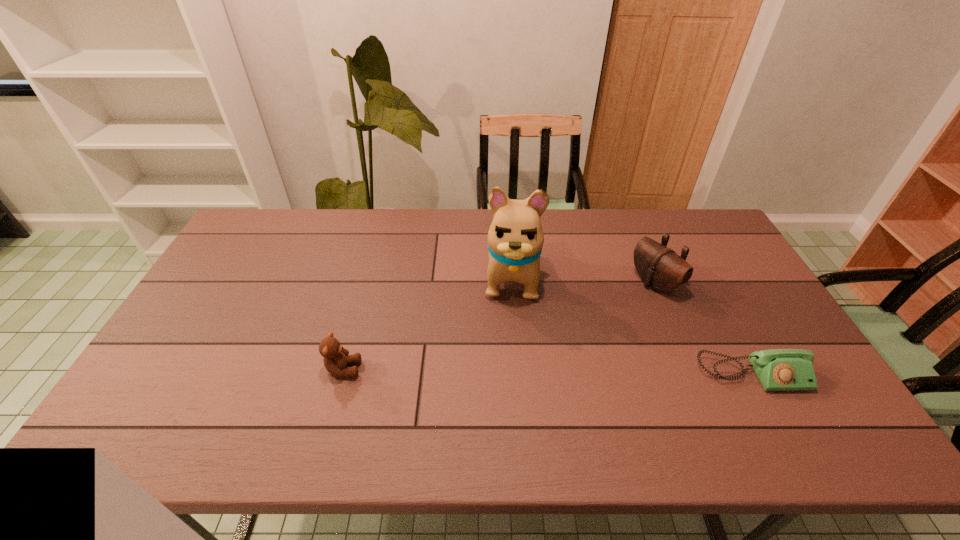
This screenshot has width=960, height=540. What are the coordinates of `vacant space on the desktop that is between the teddy bear and the telephone and is positioned on the face of the second object from left to right` in the screenshot? It's located at (506, 372).

Where is `vacant space on the desktop that is between the second shortest object and the shortest object and is positioned with the flap open on the second tallest object`? The width and height of the screenshot is (960, 540). vacant space on the desktop that is between the second shortest object and the shortest object and is positioned with the flap open on the second tallest object is located at coordinates (492, 371).